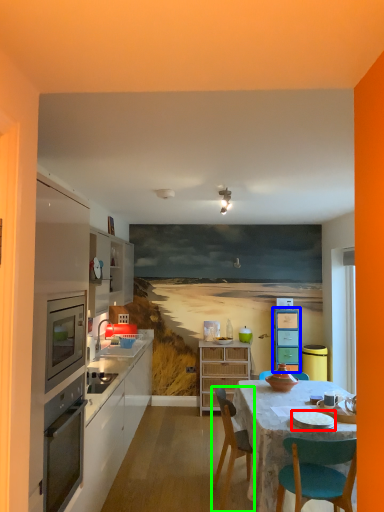
Question: Which is farther away from tableware (highlighted by a red box)? cabinetry (highlighted by a blue box) or chair (highlighted by a green box)?

Choices:
 (A) cabinetry
 (B) chair

Answer: (A)